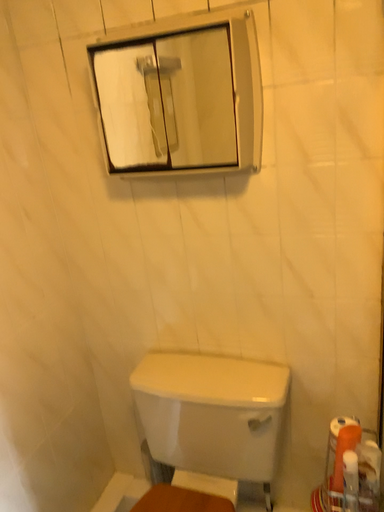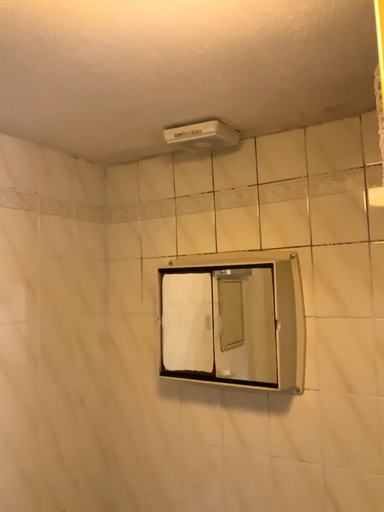
Question: How did the camera likely rotate when shooting the video?

Choices:
 (A) rotated downward
 (B) rotated upward

Answer: (B)